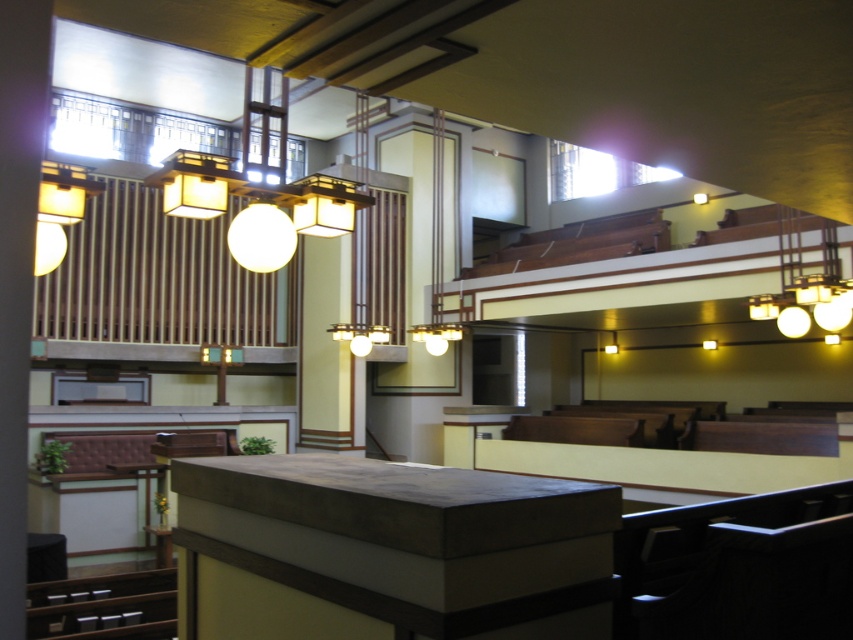
What are the coordinates of the matte gold chandelier at upper center?

The coordinates of the matte gold chandelier at upper center are point (x=259, y=186).

You are an interior designer planning to install a new light fixture in this space. You have a small, modern pendant light that is 1 meter in diameter. You want to place it between the matte gold chandelier at upper center and the matte white chandelier at upper right. Based on their sizes, will the new pendant light fit proportionally between them?

The matte gold chandelier at upper center is larger in size than the matte white chandelier at upper right. Since the new pendant light is 1 meter in diameter, it could fit proportionally between them if the size difference between the existing chandeliers allows for a medium size fixture. However, without exact measurements, it is recommended to check the dimensions of both existing chandeliers to ensure proper proportion.

You are standing in the center of the room and looking up. Which object corresponds to the point marked at coordinates [259,186]?

The point marked at coordinates [259,186] corresponds to the matte gold chandelier at upper center.